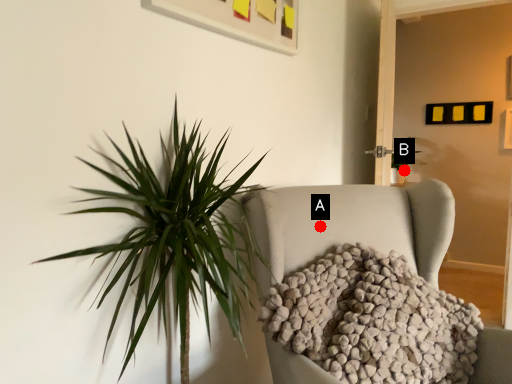
Question: Two points are circled on the image, labeled by A and B beside each circle. Which of the following is the closest to the observer?

Choices:
 (A) A is closer
 (B) B is closer

Answer: (A)